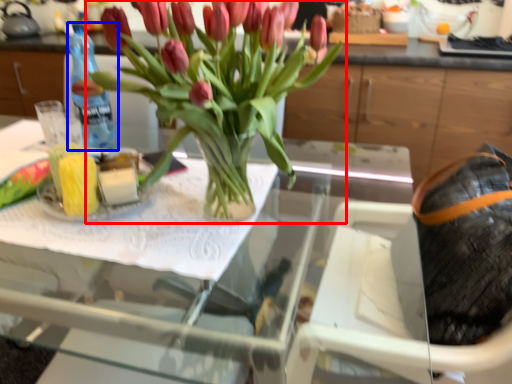
Question: Which object is further to the camera taking this photo, houseplant (highlighted by a red box) or bottle (highlighted by a blue box)?

Choices:
 (A) houseplant
 (B) bottle

Answer: (B)